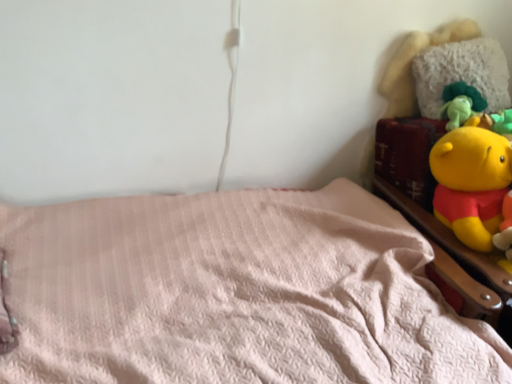
Question: Is fluffy white pillow at upper right aimed at wooden bed frame at upper right?

Choices:
 (A) yes
 (B) no

Answer: (A)

Question: Is fluffy white pillow at upper right looking in the opposite direction of wooden bed frame at upper right?

Choices:
 (A) no
 (B) yes

Answer: (A)

Question: Can you confirm if fluffy white pillow at upper right is wider than wooden bed frame at upper right?

Choices:
 (A) yes
 (B) no

Answer: (B)

Question: Considering the relative sizes of fluffy white pillow at upper right and wooden bed frame at upper right in the image provided, is fluffy white pillow at upper right bigger than wooden bed frame at upper right?

Choices:
 (A) yes
 (B) no

Answer: (B)

Question: Does fluffy white pillow at upper right have a lesser height compared to wooden bed frame at upper right?

Choices:
 (A) no
 (B) yes

Answer: (B)

Question: Looking at the image, does fluffy white pillow at upper right seem bigger or smaller compared to pink fluffy blanket at lower left?

Choices:
 (A) small
 (B) big

Answer: (A)

Question: Visually, is fluffy white pillow at upper right positioned to the left or to the right of pink fluffy blanket at lower left?

Choices:
 (A) right
 (B) left

Answer: (A)

Question: From a real-world perspective, is fluffy white pillow at upper right above or below pink fluffy blanket at lower left?

Choices:
 (A) below
 (B) above

Answer: (B)

Question: In the image, is fluffy white pillow at upper right positioned in front of or behind pink fluffy blanket at lower left?

Choices:
 (A) front
 (B) behind

Answer: (B)

Question: Is point (449, 51) closer or farther from the camera than point (433, 264)?

Choices:
 (A) closer
 (B) farther

Answer: (B)

Question: In terms of width, does fluffy white pillow at upper right look wider or thinner when compared to wooden bed frame at upper right?

Choices:
 (A) wide
 (B) thin

Answer: (B)

Question: Considering their positions, is fluffy white pillow at upper right located in front of or behind wooden bed frame at upper right?

Choices:
 (A) behind
 (B) front

Answer: (A)

Question: Looking at the image, does fluffy white pillow at upper right seem bigger or smaller compared to wooden bed frame at upper right?

Choices:
 (A) big
 (B) small

Answer: (B)

Question: In terms of size, does pink fluffy blanket at lower left appear bigger or smaller than fluffy white pillow at upper right?

Choices:
 (A) big
 (B) small

Answer: (A)

Question: Considering the positions of point (353, 316) and point (501, 52), is point (353, 316) closer or farther from the camera than point (501, 52)?

Choices:
 (A) farther
 (B) closer

Answer: (B)